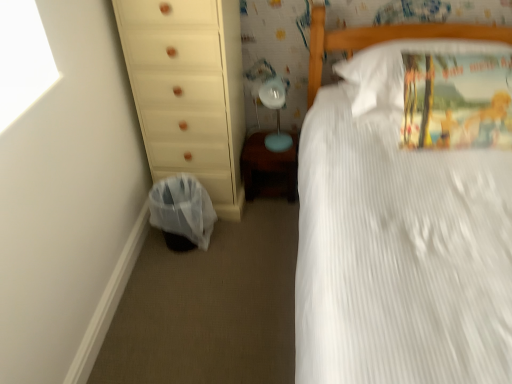
I want to click on free point to the right of plastic bag at lower left, so click(243, 239).